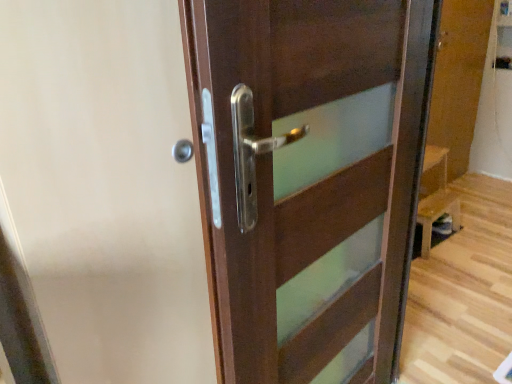
Find the location of a particular element. This screenshot has width=512, height=384. matte wood screen door at center is located at coordinates (105, 188).

Describe the element at coordinates (105, 188) in the screenshot. I see `matte wood screen door at center` at that location.

Measure the distance between matte wood screen door at center and camera.

matte wood screen door at center and camera are 24.33 inches apart from each other.

I want to click on dark wood door at center, so click(308, 176).

Describe the element at coordinates (308, 176) in the screenshot. I see `dark wood door at center` at that location.

Identify the location of matte wood screen door at center. This screenshot has width=512, height=384. (105, 188).

Considering the relative positions of matte wood screen door at center and dark wood door at center in the image provided, is matte wood screen door at center to the left of dark wood door at center from the viewer's perspective?

Correct, you'll find matte wood screen door at center to the left of dark wood door at center.

Is matte wood screen door at center in front of or behind dark wood door at center in the image?

In the image, matte wood screen door at center appears behind dark wood door at center.

Which point is more distant from viewer, [2,124] or [308,119]?

The point [308,119] is farther from the camera.

From the image's perspective, relative to dark wood door at center, is matte wood screen door at center above or below?

Based on their image positions, matte wood screen door at center is located above dark wood door at center.

From a real-world perspective, is matte wood screen door at center positioned over dark wood door at center based on gravity?

Yes, from a real-world perspective, matte wood screen door at center is above dark wood door at center.

Looking at their sizes, would you say matte wood screen door at center is wider or thinner than dark wood door at center?

Considering their sizes, matte wood screen door at center looks slimmer than dark wood door at center.

Between matte wood screen door at center and dark wood door at center, which one has less height?

dark wood door at center.

Looking at this image, can you confirm if matte wood screen door at center is bigger than dark wood door at center?

Yes.

Which is correct: matte wood screen door at center is inside dark wood door at center, or outside of it?

matte wood screen door at center is located beyond the bounds of dark wood door at center.

Is there a large distance between matte wood screen door at center and dark wood door at center?

matte wood screen door at center is actually quite close to dark wood door at center.

Does matte wood screen door at center turn towards dark wood door at center?

Yes, matte wood screen door at center is facing dark wood door at center.

Measure the distance between matte wood screen door at center and dark wood door at center.

A distance of 12.36 inches exists between matte wood screen door at center and dark wood door at center.

Locate an element on the screen. Image resolution: width=512 pixels, height=384 pixels. screen door on the left side of dark wood door at center is located at coordinates (105, 188).

Can you confirm if dark wood door at center is positioned to the left of matte wood screen door at center?

No, dark wood door at center is not to the left of matte wood screen door at center.

Is the position of dark wood door at center more distant than that of matte wood screen door at center?

No, dark wood door at center is closer to the camera.

Is point (371, 220) positioned after point (8, 30)?

That is True.

From the image's perspective, is dark wood door at center under matte wood screen door at center?

Yes.

From a real-world perspective, between dark wood door at center and matte wood screen door at center, who is vertically higher?

matte wood screen door at center is physically above.

Considering the sizes of objects dark wood door at center and matte wood screen door at center in the image provided, who is thinner, dark wood door at center or matte wood screen door at center?

Thinner between the two is matte wood screen door at center.

In terms of height, does dark wood door at center look taller or shorter compared to matte wood screen door at center?

Considering their sizes, dark wood door at center has less height than matte wood screen door at center.

Who is smaller, dark wood door at center or matte wood screen door at center?

dark wood door at center is smaller.

Is dark wood door at center completely or partially outside of matte wood screen door at center?

Absolutely, dark wood door at center is external to matte wood screen door at center.

Is dark wood door at center beside matte wood screen door at center?

No, dark wood door at center is not in contact with matte wood screen door at center.

Is dark wood door at center facing away from matte wood screen door at center?

No, dark wood door at center is not facing the opposite direction of matte wood screen door at center.

Measure the distance between dark wood door at center and matte wood screen door at center.

They are 12.36 inches apart.

The width and height of the screenshot is (512, 384). What are the coordinates of `screen door above the dark wood door at center (from a real-world perspective)` in the screenshot? It's located at (105, 188).

The height and width of the screenshot is (384, 512). Identify the location of screen door located on the left of dark wood door at center. (105, 188).

The image size is (512, 384). What are the coordinates of `door below the matte wood screen door at center (from the image's perspective)` in the screenshot? It's located at (308, 176).